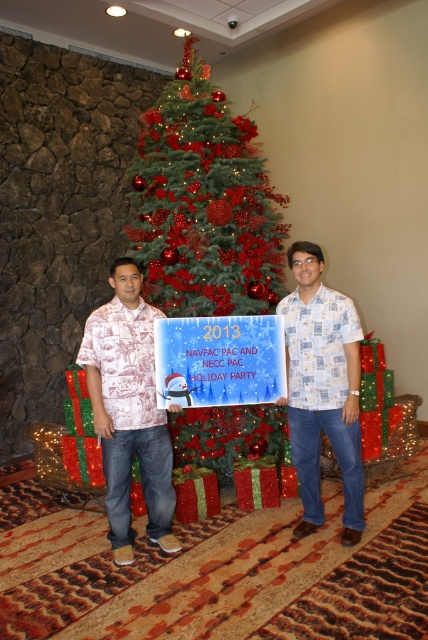
Question: Can you confirm if green textured christmas tree at center is thinner than printed cotton shirt at center?

Choices:
 (A) yes
 (B) no

Answer: (B)

Question: Can you confirm if printed cotton shirt at center is smaller than white printed sign at center?

Choices:
 (A) yes
 (B) no

Answer: (B)

Question: Estimate the real-world distances between objects in this image. Which object is closer to the white printed shirt at center?

Choices:
 (A) printed cotton shirt at center
 (B) white printed sign at center

Answer: (B)

Question: Is the position of green textured christmas tree at center less distant than that of white printed shirt at center?

Choices:
 (A) no
 (B) yes

Answer: (A)

Question: Which of these objects is positioned farthest from the white printed sign at center?

Choices:
 (A) green textured christmas tree at center
 (B) white printed shirt at center
 (C) printed cotton shirt at center

Answer: (A)

Question: Which of the following is the farthest from the observer?

Choices:
 (A) [152, 467]
 (B) [312, 458]
 (C) [214, 310]

Answer: (C)